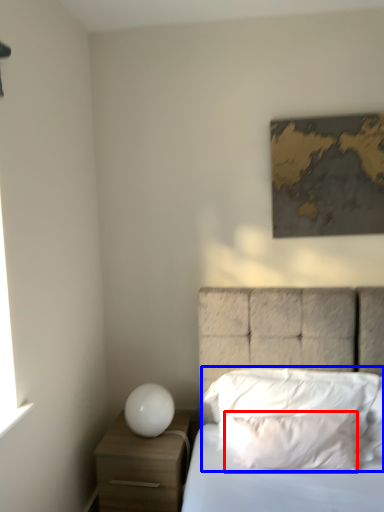
Question: Which point is further to the camera, pillow (highlighted by a red box) or pillow (highlighted by a blue box)?

Choices:
 (A) pillow
 (B) pillow

Answer: (B)